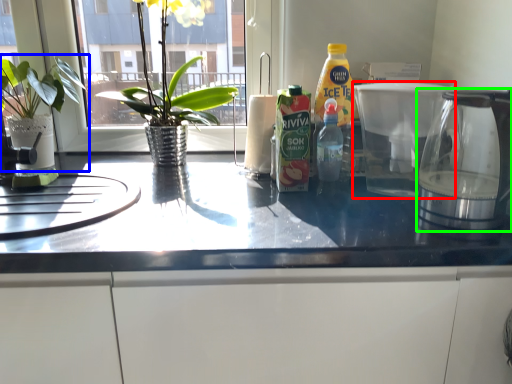
Question: Which object is positioned farthest from coffeepot (highlighted by a red box)? Select from houseplant (highlighted by a blue box) and coffeepot (highlighted by a green box).

Choices:
 (A) houseplant
 (B) coffeepot

Answer: (A)